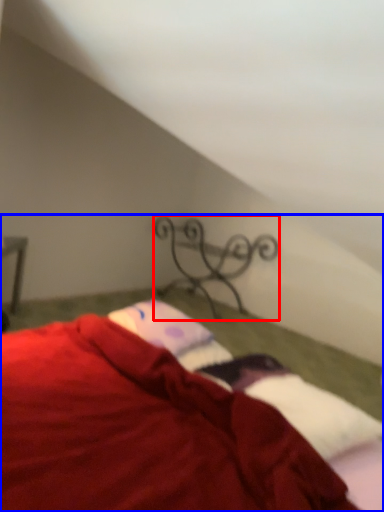
Question: Which of the following is the closest to the observer, design (highlighted by a red box) or bed (highlighted by a blue box)?

Choices:
 (A) design
 (B) bed

Answer: (B)